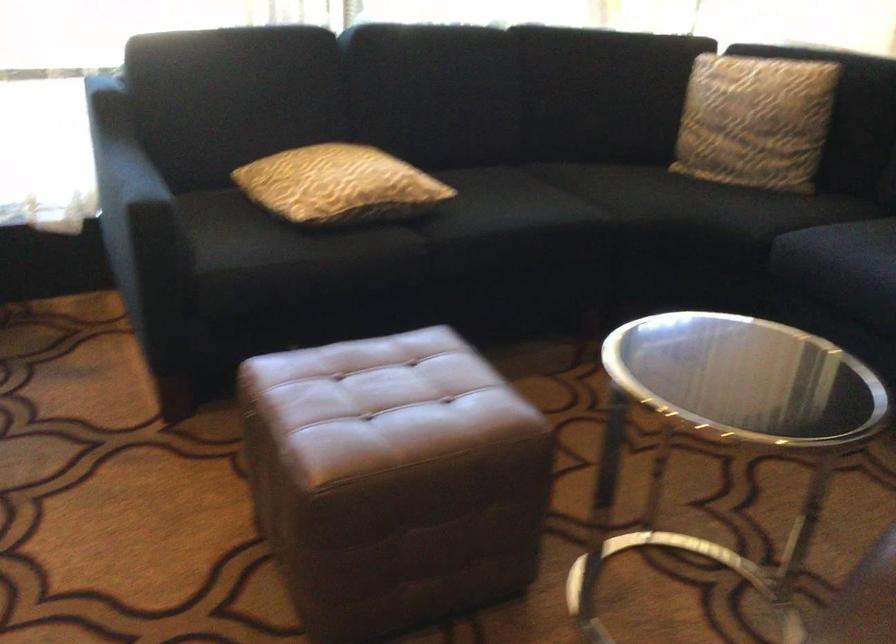
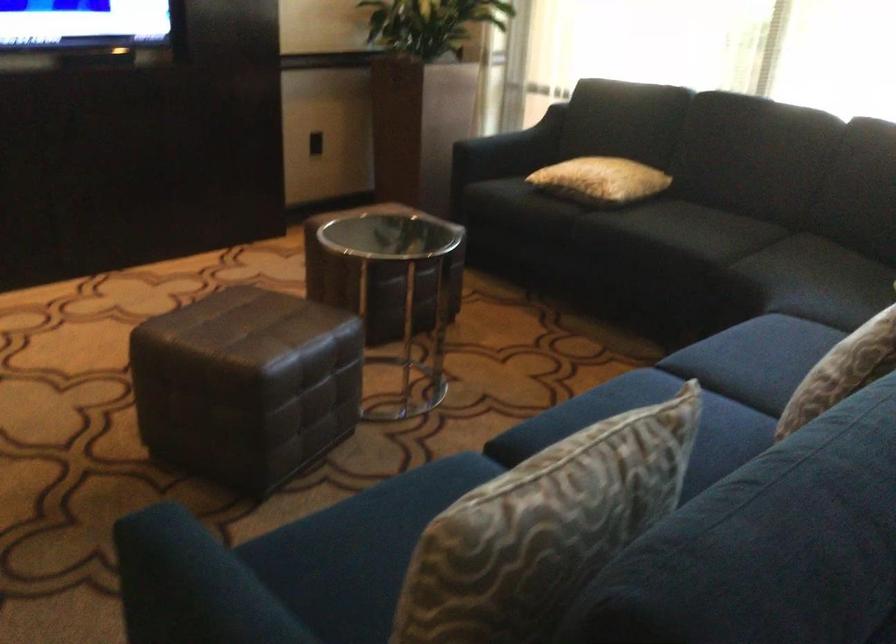
Where in the second image is the point corresponding to (118,162) from the first image?

(506, 128)